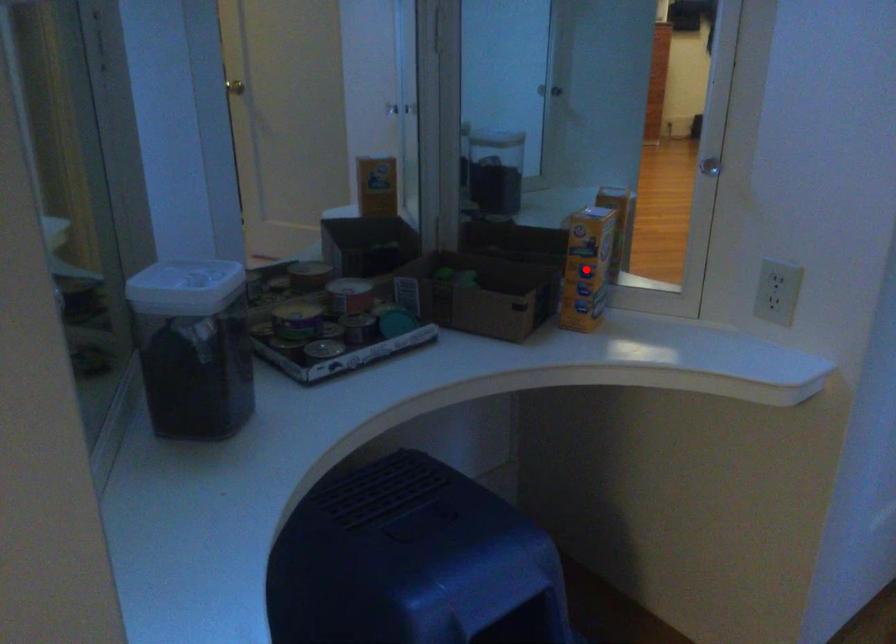
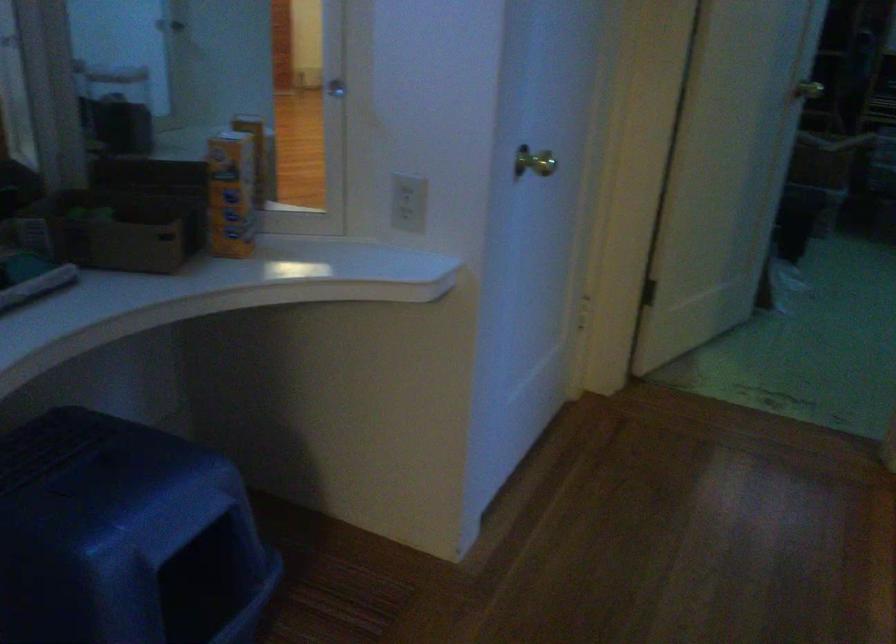
Find the pixel in the second image that matches the highlighted location in the first image.

(230, 194)